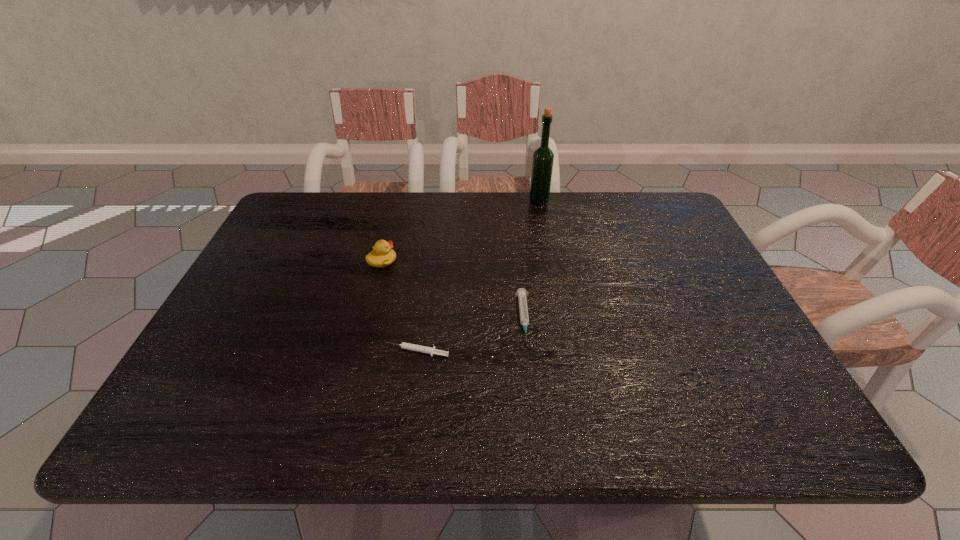
Where is `unoccupied position between the left syringe and the third nearest object`? The height and width of the screenshot is (540, 960). unoccupied position between the left syringe and the third nearest object is located at coordinates (399, 306).

Where is `free area in between the right syringe and the shorter syringe`? This screenshot has width=960, height=540. free area in between the right syringe and the shorter syringe is located at coordinates (470, 335).

The height and width of the screenshot is (540, 960). Identify the location of vacant space that's between the taller syringe and the duckling. tap(453, 289).

Find the location of a particular element. This screenshot has height=540, width=960. free spot between the farthest object and the third nearest object is located at coordinates (461, 231).

Where is `vacant area that lies between the taller syringe and the second tallest object`? This screenshot has width=960, height=540. vacant area that lies between the taller syringe and the second tallest object is located at coordinates (453, 289).

Find the location of a particular element. Image resolution: width=960 pixels, height=540 pixels. vacant area between the third object from left to right and the third shortest object is located at coordinates (453, 289).

The image size is (960, 540). I want to click on free spot between the left syringe and the third nearest object, so click(x=399, y=306).

Locate an element on the screen. vacant space that is in between the third nearest object and the right syringe is located at coordinates click(x=453, y=289).

Locate an element on the screen. The height and width of the screenshot is (540, 960). empty space between the second tallest object and the second shortest object is located at coordinates (453, 289).

Select which object appears as the third closest to the rightmost object. Please provide its 2D coordinates. Your answer should be formatted as a tuple, i.e. [(x, y)], where the tuple contains the x and y coordinates of a point satisfying the conditions above.

[(408, 346)]